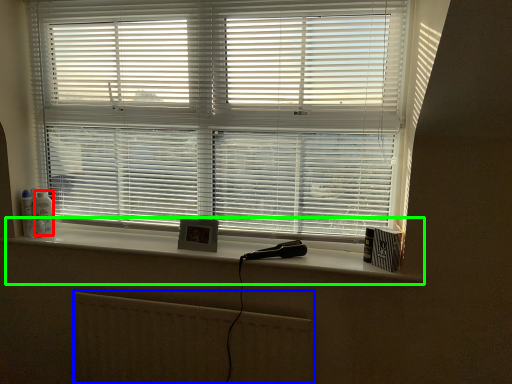
Question: Considering the real-world distances, which object is closest to toiletry (highlighted by a red box)? radiator (highlighted by a blue box) or window sill (highlighted by a green box).

Choices:
 (A) radiator
 (B) window sill

Answer: (B)